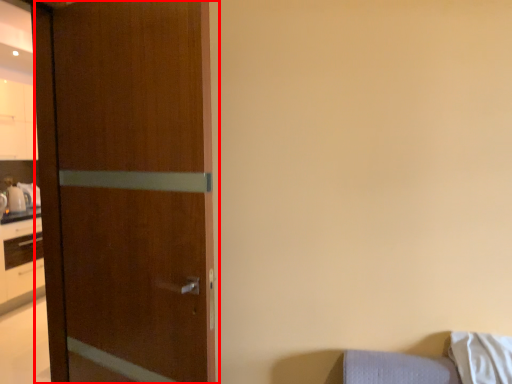
Question: Observing the image, what is the correct spatial positioning of door (annotated by the red box) in reference to pillow?

Choices:
 (A) right
 (B) left

Answer: (B)